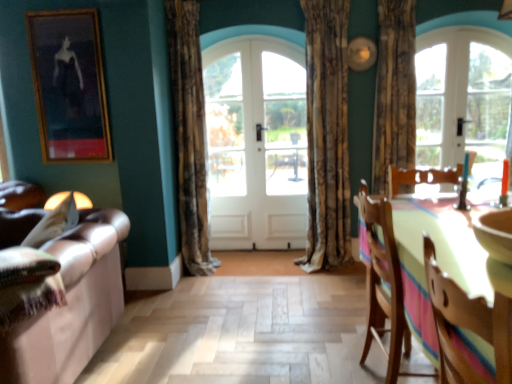
The height and width of the screenshot is (384, 512). I want to click on free space above wooden framed painting at upper left (from a real-world perspective), so click(60, 11).